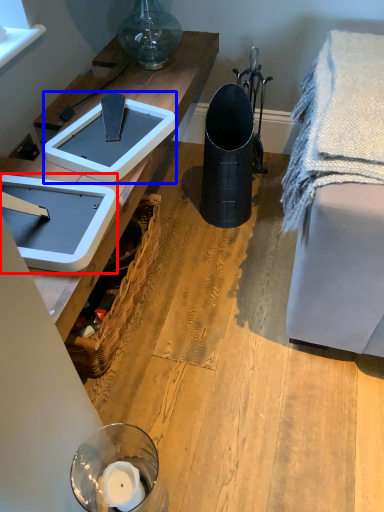
Question: Which object appears closest to the camera in this image, weight scale (highlighted by a red box) or weight scale (highlighted by a blue box)?

Choices:
 (A) weight scale
 (B) weight scale

Answer: (A)